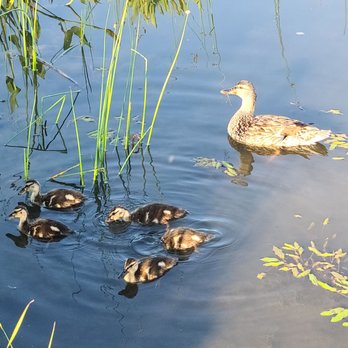
You are a GUI agent. You are given a task and a screenshot of the screen. Output one action in this format:
    pyautogui.click(x=<x>, y=<y>)
    Task: Click on the plant
    This screenshot has height=348, width=348.
    Given the screenshot: What is the action you would take?
    [x=294, y=256]